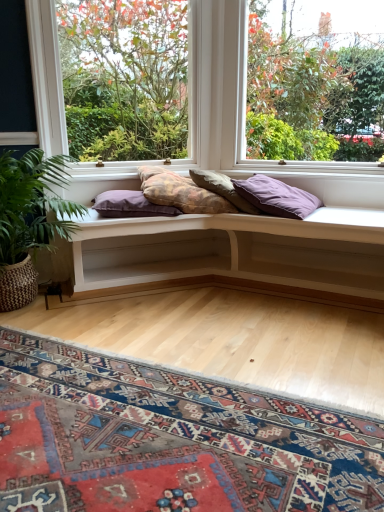
Locate an element on the screen. Image resolution: width=384 pixels, height=512 pixels. vacant space underneath white wood bench at center (from a real-world perspective) is located at coordinates (228, 308).